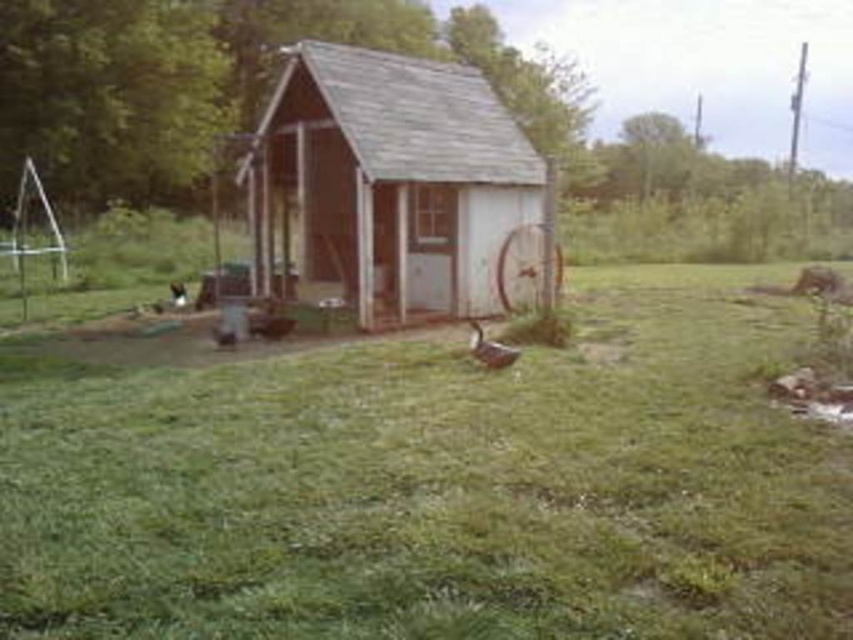
Between green grass at center and brown matte duck at center, which one has more height?

green grass at center is taller.

Does green grass at center appear under brown matte duck at center?

Correct, green grass at center is located below brown matte duck at center.

Describe the element at coordinates (439, 484) in the screenshot. I see `green grass at center` at that location.

The height and width of the screenshot is (640, 853). What are the coordinates of `green grass at center` in the screenshot? It's located at (439, 484).

Does point (428, 196) come closer to viewer compared to point (505, 349)?

No, (428, 196) is behind (505, 349).

Does wooden shed at center have a greater height compared to brown matte duck at center?

No.

This screenshot has height=640, width=853. What do you see at coordinates (390, 182) in the screenshot? I see `wooden shed at center` at bounding box center [390, 182].

At what (x,y) coordinates should I click in order to perform the action: click on wooden shed at center. Please return your answer as a coordinate pair (x, y). This screenshot has height=640, width=853. Looking at the image, I should click on pos(390,182).

Can you confirm if green grass at center is wider than wooden shed at center?

Yes, green grass at center is wider than wooden shed at center.

How far apart are green grass at center and wooden shed at center?

green grass at center is 21.20 feet from wooden shed at center.

This screenshot has height=640, width=853. What do you see at coordinates (439, 484) in the screenshot?
I see `green grass at center` at bounding box center [439, 484].

At what (x,y) coordinates should I click in order to perform the action: click on green grass at center. Please return your answer as a coordinate pair (x, y). This screenshot has width=853, height=640. Looking at the image, I should click on (439, 484).